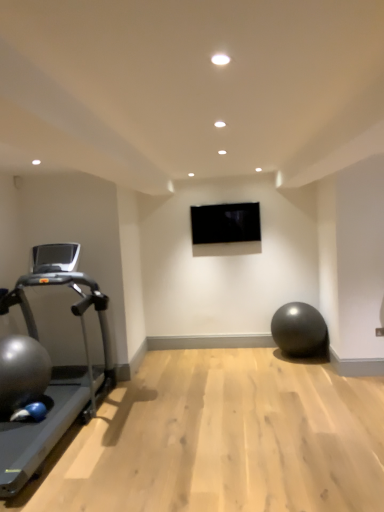
What do you see at coordinates (22, 371) in the screenshot? This screenshot has width=384, height=512. I see `shiny metallic ball at left, which is the first ball in left-to-right order` at bounding box center [22, 371].

The height and width of the screenshot is (512, 384). I want to click on shiny metallic ball at left, the second ball positioned from the back, so click(22, 371).

Locate an element on the screen. The height and width of the screenshot is (512, 384). silver metallic treadmill at left is located at coordinates (55, 368).

The width and height of the screenshot is (384, 512). In order to click on shiny metallic ball at left, which appears as the second ball when viewed from the right in this screenshot , I will do pyautogui.click(x=22, y=371).

Is shiny metallic ball at left, which appears as the second ball when viewed from the right, positioned before black glossy tv at center?

That is True.

Is shiny metallic ball at left, which appears as the second ball when viewed from the right, facing away from black glossy tv at center?

No, black glossy tv at center is not at the back of shiny metallic ball at left, which appears as the second ball when viewed from the right.

Is shiny metallic ball at left, which appears as the second ball when viewed from the right, inside the boundaries of black glossy tv at center, or outside?

shiny metallic ball at left, which appears as the second ball when viewed from the right, is not enclosed by black glossy tv at center.

From a real-world perspective, relative to shiny metallic ball at left, the first ball positioned from the front, is matte black ball at lower right, which is the second ball in front-to-back order, vertically above or below?

matte black ball at lower right, which is the second ball in front-to-back order, is below shiny metallic ball at left, the first ball positioned from the front.

Does matte black ball at lower right, which appears as the 2th ball when viewed from the left, have a lesser height compared to shiny metallic ball at left, the second ball positioned from the back?

In fact, matte black ball at lower right, which appears as the 2th ball when viewed from the left, may be taller than shiny metallic ball at left, the second ball positioned from the back.

Between matte black ball at lower right, marked as the first ball in a back-to-front arrangement, and shiny metallic ball at left, which appears as the second ball when viewed from the right, which one has smaller size?

matte black ball at lower right, marked as the first ball in a back-to-front arrangement, is smaller.

Does matte black ball at lower right, which is the second ball in front-to-back order, turn towards shiny metallic ball at left, the second ball positioned from the back?

No.

Between matte black ball at lower right, which is the second ball in front-to-back order, and black glossy tv at center, which one appears on the right side from the viewer's perspective?

From the viewer's perspective, matte black ball at lower right, which is the second ball in front-to-back order, appears more on the right side.

Would you say matte black ball at lower right, marked as the first ball in a back-to-front arrangement, is inside or outside black glossy tv at center?

matte black ball at lower right, marked as the first ball in a back-to-front arrangement, exists outside the volume of black glossy tv at center.

Based on the photo, who is more distant, matte black ball at lower right, which is the second ball in front-to-back order, or black glossy tv at center?

black glossy tv at center is further away from the camera.

Is matte black ball at lower right, marked as the first ball in a back-to-front arrangement, positioned far away from black glossy tv at center?

matte black ball at lower right, marked as the first ball in a back-to-front arrangement, is far away from black glossy tv at center.

Which object is more forward, black glossy tv at center or silver metallic treadmill at left?

silver metallic treadmill at left is more forward.

Considering the relative positions of black glossy tv at center and silver metallic treadmill at left in the image provided, is black glossy tv at center to the left of silver metallic treadmill at left from the viewer's perspective?

No, black glossy tv at center is not to the left of silver metallic treadmill at left.

Does black glossy tv at center have a larger size compared to silver metallic treadmill at left?

No, black glossy tv at center is not bigger than silver metallic treadmill at left.

Where is `projection screen behind the silver metallic treadmill at left`? projection screen behind the silver metallic treadmill at left is located at coordinates (225, 223).

From a real-world perspective, which is physically above, shiny metallic ball at left, the first ball positioned from the front, or silver metallic treadmill at left?

In real-world perspective, silver metallic treadmill at left is above.

Is shiny metallic ball at left, the first ball positioned from the front, looking in the opposite direction of silver metallic treadmill at left?

Yes, shiny metallic ball at left, the first ball positioned from the front, is positioned with its back facing silver metallic treadmill at left.

Is shiny metallic ball at left, which appears as the second ball when viewed from the right, in front of or behind silver metallic treadmill at left in the image?

shiny metallic ball at left, which appears as the second ball when viewed from the right, is positioned farther from the viewer than silver metallic treadmill at left.

Would you consider shiny metallic ball at left, which appears as the second ball when viewed from the right, to be distant from silver metallic treadmill at left?

No, shiny metallic ball at left, which appears as the second ball when viewed from the right, is not far away from silver metallic treadmill at left.

Is silver metallic treadmill at left bigger than black glossy tv at center?

Yes.

Based on the photo, is silver metallic treadmill at left in front of or behind black glossy tv at center in the image?

In the image, silver metallic treadmill at left appears in front of black glossy tv at center.

Is silver metallic treadmill at left facing away from black glossy tv at center?

silver metallic treadmill at left does not have its back to black glossy tv at center.

From a real-world perspective, who is located higher, silver metallic treadmill at left or shiny metallic ball at left, the second ball positioned from the back?

From a 3D spatial view, silver metallic treadmill at left is above.

This screenshot has width=384, height=512. Identify the location of treadmill above the shiny metallic ball at left, which appears as the second ball when viewed from the right (from the image's perspective). (x=55, y=368).

What's the angular difference between silver metallic treadmill at left and shiny metallic ball at left, the second ball positioned from the back,'s facing directions?

The facing directions of silver metallic treadmill at left and shiny metallic ball at left, the second ball positioned from the back, are 1.43 degrees apart.

Could you tell me if silver metallic treadmill at left is turned towards shiny metallic ball at left, which appears as the second ball when viewed from the right?

Yes, silver metallic treadmill at left faces towards shiny metallic ball at left, which appears as the second ball when viewed from the right.

From the black glossy tv at center, count 2nd balls forward and point to it. Please provide its 2D coordinates.

[(22, 371)]

You are a GUI agent. You are given a task and a screenshot of the screen. Output one action in this format:
    pyautogui.click(x=<x>, y=<y>)
    Task: Click on the ball on the right of shiny metallic ball at left, the first ball positioned from the front
    This screenshot has width=384, height=512.
    Given the screenshot: What is the action you would take?
    pyautogui.click(x=299, y=330)

From the image, which object appears to be farther from silver metallic treadmill at left, black glossy tv at center or matte black ball at lower right, which is the second ball in front-to-back order?

Based on the image, matte black ball at lower right, which is the second ball in front-to-back order, appears to be further to silver metallic treadmill at left.

Looking at the image, which one is located further to silver metallic treadmill at left, matte black ball at lower right, which appears as the 2th ball when viewed from the left, or shiny metallic ball at left, which is the first ball in left-to-right order?

matte black ball at lower right, which appears as the 2th ball when viewed from the left, is positioned further to the anchor silver metallic treadmill at left.

Considering their positions, is silver metallic treadmill at left positioned closer to matte black ball at lower right, which appears as the 2th ball when viewed from the left, than black glossy tv at center?

Based on the image, black glossy tv at center appears to be nearer to matte black ball at lower right, which appears as the 2th ball when viewed from the left.

Based on the photo, considering their positions, is silver metallic treadmill at left positioned closer to shiny metallic ball at left, which appears as the second ball when viewed from the right, than black glossy tv at center?

silver metallic treadmill at left lies closer to shiny metallic ball at left, which appears as the second ball when viewed from the right, than the other object.

Based on their spatial positions, is black glossy tv at center or silver metallic treadmill at left closer to matte black ball at lower right, marked as the first ball in a back-to-front arrangement?

black glossy tv at center is closer to matte black ball at lower right, marked as the first ball in a back-to-front arrangement.

When comparing their distances from shiny metallic ball at left, which is the first ball in left-to-right order, does silver metallic treadmill at left or matte black ball at lower right, which appears as the 2th ball when viewed from the left, seem closer?

silver metallic treadmill at left is closer to shiny metallic ball at left, which is the first ball in left-to-right order.

Which object lies nearer to the anchor point shiny metallic ball at left, which is the first ball in left-to-right order, matte black ball at lower right, marked as the first ball in a back-to-front arrangement, or black glossy tv at center?

The object closer to shiny metallic ball at left, which is the first ball in left-to-right order, is black glossy tv at center.

Looking at the image, which one is located closer to silver metallic treadmill at left, black glossy tv at center or shiny metallic ball at left, the first ball positioned from the front?

shiny metallic ball at left, the first ball positioned from the front, lies closer to silver metallic treadmill at left than the other object.

Identify the location of treadmill between shiny metallic ball at left, which appears as the second ball when viewed from the right, and matte black ball at lower right, which appears as the 2th ball when viewed from the left, from left to right. (55, 368).

Locate an element on the screen. This screenshot has height=512, width=384. projection screen located between shiny metallic ball at left, the second ball positioned from the back, and matte black ball at lower right, which appears as the 2th ball when viewed from the left, in the left-right direction is located at coordinates (225, 223).